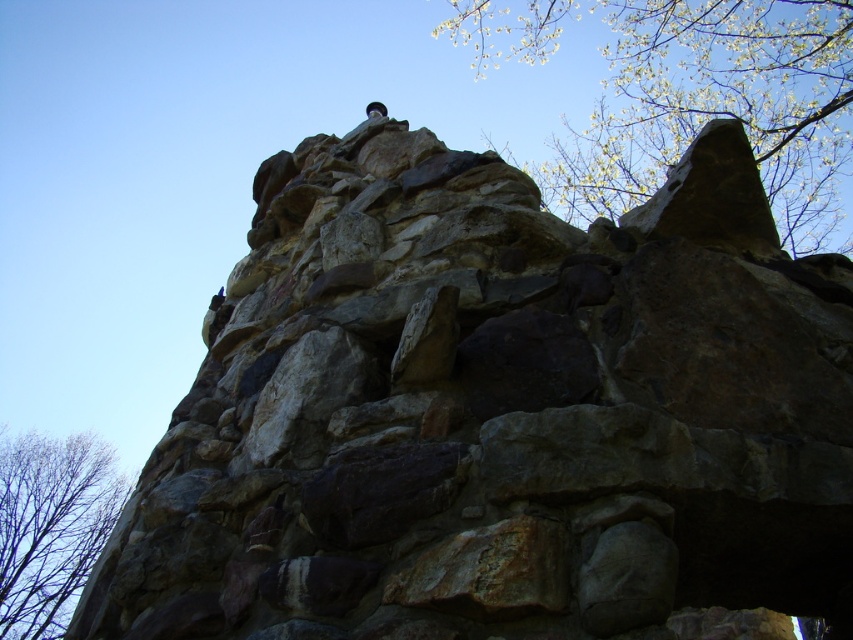
You are standing in front of the stone structure and want to take a photo of the green leafy tree at upper right and the bare branches at lower left. Which object will appear closer to you in the photo?

The green leafy tree at upper right will appear closer to you in the photo because it is positioned in front of the bare branches at lower left.

You are standing at the base of the stone structure shown in the image. You notice a point marked at coordinates (x=692, y=96). What object is located at that point?

The point at coordinates (x=692, y=96) indicates a green leafy tree at upper right.

Looking at this image, you are standing at the base of the stone structure and looking up. Which object is higher up in the image, the green leafy tree at upper right or the bare branches at lower left?

The green leafy tree at upper right is higher up than the bare branches at lower left in the image.